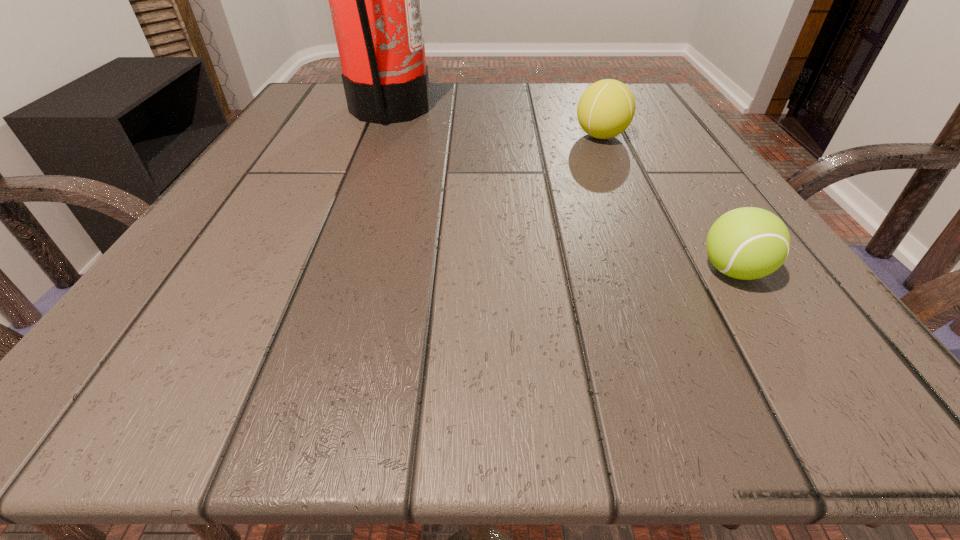
Locate an element on the screen. This screenshot has height=540, width=960. object that is the second closest one to the fire extinguisher is located at coordinates (747, 243).

Where is `object that is the closest to the tallest object`? object that is the closest to the tallest object is located at coordinates (606, 108).

Where is `vacant space that satisfies the following two spatial constraints: 1. on the back side of the farther tennis ball; 2. on the front side of the tallest object`? vacant space that satisfies the following two spatial constraints: 1. on the back side of the farther tennis ball; 2. on the front side of the tallest object is located at coordinates (589, 111).

In order to click on free space that satisfies the following two spatial constraints: 1. on the front side of the leftmost object; 2. on the right side of the nearest object in this screenshot , I will do `click(330, 271)`.

The width and height of the screenshot is (960, 540). What are the coordinates of `free space that satisfies the following two spatial constraints: 1. on the front side of the farther tennis ball; 2. on the left side of the tallest object` in the screenshot? It's located at (380, 136).

What are the coordinates of `vacant position in the image that satisfies the following two spatial constraints: 1. on the front side of the shorter tennis ball; 2. on the right side of the leftmost object` in the screenshot? It's located at (330, 271).

At what (x,y) coordinates should I click in order to perform the action: click on free location that satisfies the following two spatial constraints: 1. on the front side of the fire extinguisher; 2. on the back side of the nearer tennis ball. Please return your answer as a coordinate pair (x, y). The height and width of the screenshot is (540, 960). Looking at the image, I should click on (330, 271).

Locate an element on the screen. free spot that satisfies the following two spatial constraints: 1. on the front side of the tallest object; 2. on the left side of the farther tennis ball is located at coordinates (380, 136).

Image resolution: width=960 pixels, height=540 pixels. I want to click on free region that satisfies the following two spatial constraints: 1. on the front side of the farther tennis ball; 2. on the right side of the tallest object, so [x=380, y=136].

You are a GUI agent. You are given a task and a screenshot of the screen. Output one action in this format:
    pyautogui.click(x=<x>, y=<y>)
    Task: Click on the blank space that satisfies the following two spatial constraints: 1. on the front side of the farther tennis ball; 2. on the right side of the tallest object
    The image size is (960, 540).
    Given the screenshot: What is the action you would take?
    pyautogui.click(x=380, y=136)